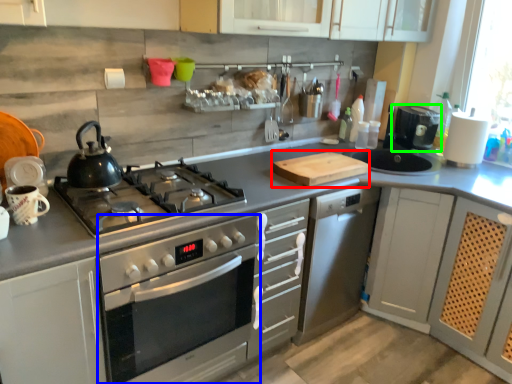
Question: Which object is the farthest from cutting board (highlighted by a red box)? Choose among these: oven (highlighted by a blue box) or coffee machine (highlighted by a green box).

Choices:
 (A) oven
 (B) coffee machine

Answer: (B)